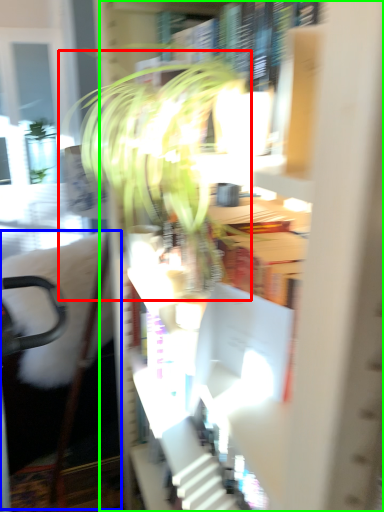
Question: Considering the real-world distances, which object is closest to houseplant (highlighted by a red box)? swivel chair (highlighted by a blue box) or bookcase (highlighted by a green box).

Choices:
 (A) swivel chair
 (B) bookcase

Answer: (B)